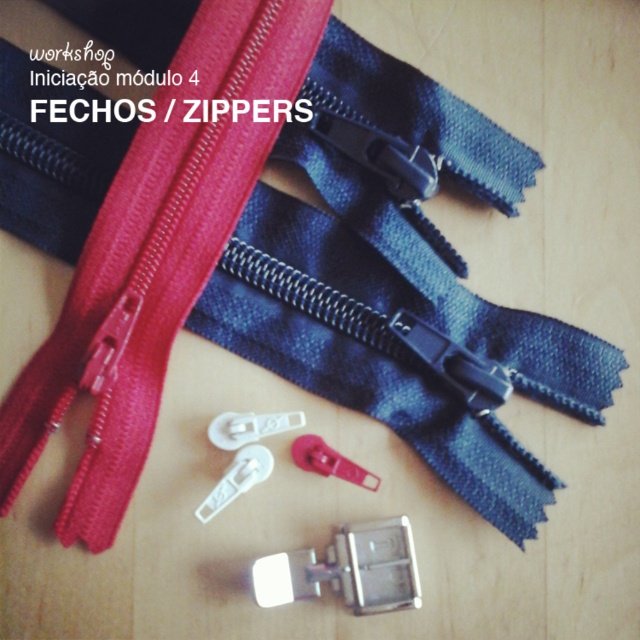
Question: Can you confirm if red matte zipper at center is positioned to the right of matte plastic zipper slider at center?

Choices:
 (A) no
 (B) yes

Answer: (A)

Question: Does red matte zipper at center come behind silver metallic buckle at center?

Choices:
 (A) yes
 (B) no

Answer: (B)

Question: Can you confirm if silver metallic buckle at center is wider than white plastic zipper slider at center?

Choices:
 (A) yes
 (B) no

Answer: (A)

Question: Estimate the real-world distances between objects in this image. Which object is farther from the red matte zipper at center?

Choices:
 (A) silver metallic buckle at center
 (B) matte plastic zipper slider at center
 (C) white plastic zipper slider at center

Answer: (A)

Question: Based on their relative distances, which object is farther from the white plastic zipper slider at center?

Choices:
 (A) matte plastic zipper slider at center
 (B) red matte zipper at center
 (C) silver metallic buckle at center

Answer: (B)

Question: Which of the following is the closest to the observer?

Choices:
 (A) (364, 595)
 (B) (220, 506)
 (C) (131, 257)
 (D) (314, 438)

Answer: (B)